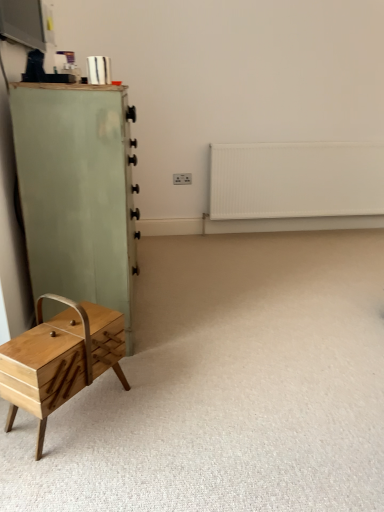
Question: Considering the positions of light green wood chest of drawers at left and white matte radiator at upper right in the image, is light green wood chest of drawers at left taller or shorter than white matte radiator at upper right?

Choices:
 (A) short
 (B) tall

Answer: (B)

Question: Considering the positions of light green wood chest of drawers at left and white matte radiator at upper right in the image, is light green wood chest of drawers at left wider or thinner than white matte radiator at upper right?

Choices:
 (A) thin
 (B) wide

Answer: (B)

Question: Based on their relative distances, which object is nearer to the wooden sewing box at lower left?

Choices:
 (A) natural wood drawer at lower left
 (B) white matte radiator at upper right
 (C) light green wood chest of drawers at left

Answer: (A)

Question: Which object is positioned closest to the natural wood drawer at lower left?

Choices:
 (A) white matte radiator at upper right
 (B) light green wood chest of drawers at left
 (C) wooden sewing box at lower left

Answer: (B)